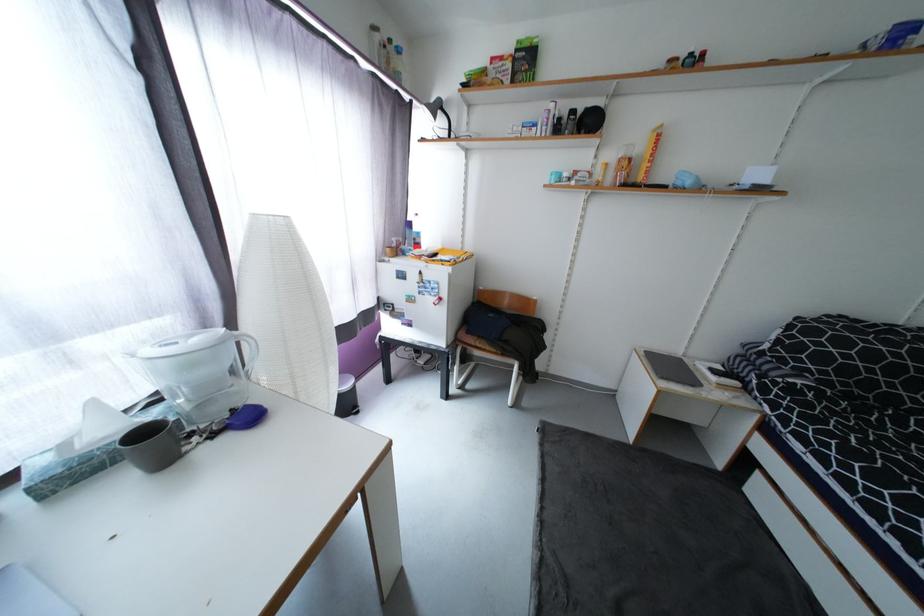
The width and height of the screenshot is (924, 616). What do you see at coordinates (346, 397) in the screenshot? I see `the trash can pedal` at bounding box center [346, 397].